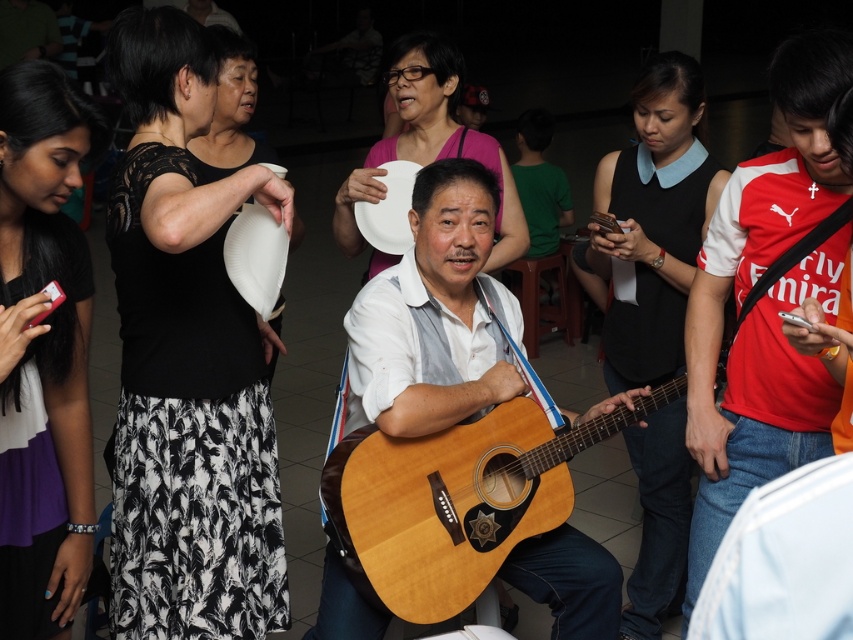
Question: Which of the following is the farthest from the observer?

Choices:
 (A) natural wood acoustic guitar at center
 (B) black matte shirt at center
 (C) black lace top at upper left

Answer: (B)

Question: Does light brown wood guitar at center appear under black matte shirt at center?

Choices:
 (A) no
 (B) yes

Answer: (A)

Question: Does red jersey at right have a larger size compared to natural wood acoustic guitar at center?

Choices:
 (A) yes
 (B) no

Answer: (B)

Question: Does black lace top at upper left have a smaller size compared to purple fabric phone at left?

Choices:
 (A) yes
 (B) no

Answer: (B)

Question: Which of the following is the closest to the observer?

Choices:
 (A) black matte shirt at center
 (B) black lace top at upper left

Answer: (B)

Question: Which of the following is the farthest from the observer?

Choices:
 (A) light brown wood guitar at center
 (B) purple fabric phone at left
 (C) black lace top at upper left

Answer: (A)